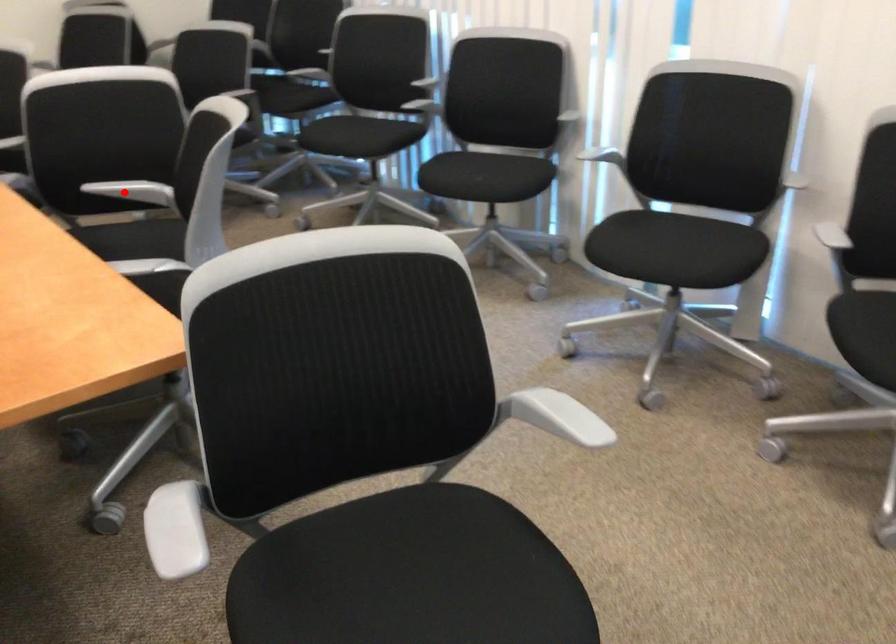
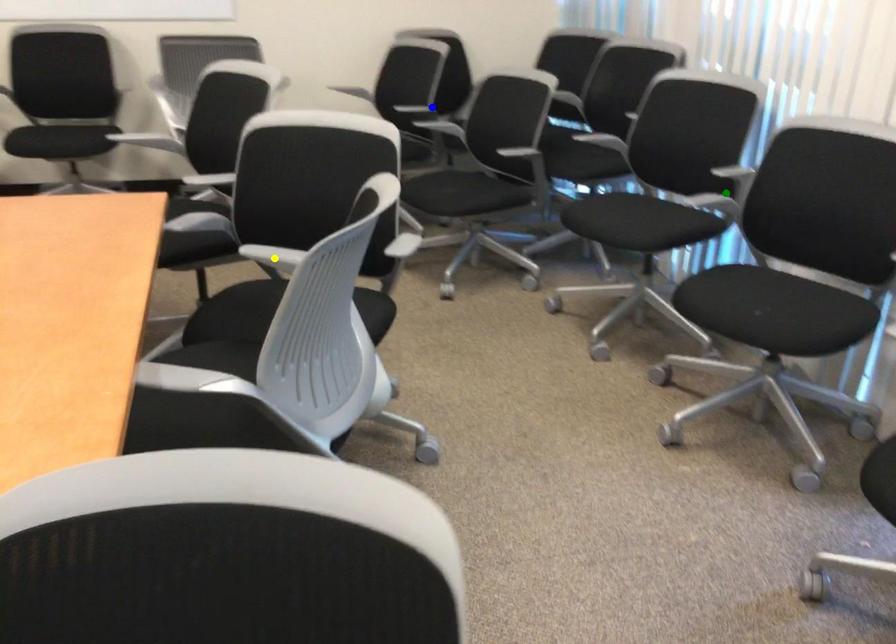
Question: I am providing you with two images of the same scene from different viewpoints. A red point is marked on the first image. You are given multiple points on the second image. Can you choose the point in image 2 that corresponds to the point in image 1?

Choices:
 (A) green point
 (B) yellow point
 (C) blue point

Answer: (B)